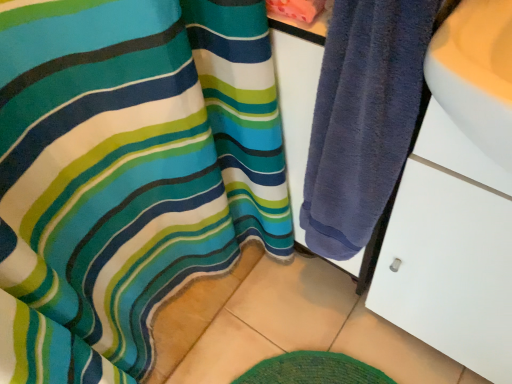
I want to click on white matte drawer at right, so click(x=449, y=268).

What do you see at coordinates (449, 268) in the screenshot?
I see `white matte drawer at right` at bounding box center [449, 268].

What is the approximate height of white matte drawer at right?

white matte drawer at right is 34.82 inches in height.

The height and width of the screenshot is (384, 512). What are the coordinates of `dark blue towel at right` in the screenshot? It's located at (362, 118).

The width and height of the screenshot is (512, 384). Describe the element at coordinates (362, 118) in the screenshot. I see `dark blue towel at right` at that location.

This screenshot has width=512, height=384. I want to click on white matte drawer at right, so click(x=449, y=268).

Which object is positioned more to the left, dark blue towel at right or white matte drawer at right?

dark blue towel at right.

Is dark blue towel at right further to the viewer compared to white matte drawer at right?

Yes, it is behind white matte drawer at right.

Is point (345, 43) closer to viewer compared to point (459, 360)?

Yes, point (345, 43) is in front of point (459, 360).

From the image's perspective, relative to white matte drawer at right, is dark blue towel at right above or below?

dark blue towel at right is above white matte drawer at right.

From a real-world perspective, which is physically below, dark blue towel at right or white matte drawer at right?

In real-world perspective, white matte drawer at right is lower.

In terms of width, does dark blue towel at right look wider or thinner when compared to white matte drawer at right?

dark blue towel at right is thinner than white matte drawer at right.

Can you confirm if dark blue towel at right is shorter than white matte drawer at right?

Indeed, dark blue towel at right has a lesser height compared to white matte drawer at right.

Between dark blue towel at right and white matte drawer at right, which one has larger size?

white matte drawer at right is bigger.

Would you say white matte drawer at right is part of dark blue towel at right's contents?

That's incorrect, white matte drawer at right is not inside dark blue towel at right.

Looking at this image, are dark blue towel at right and white matte drawer at right beside each other?

No, dark blue towel at right is not touching white matte drawer at right.

Is dark blue towel at right aimed at white matte drawer at right?

No, dark blue towel at right is not oriented towards white matte drawer at right.

How different are the orientations of dark blue towel at right and white matte drawer at right in degrees?

dark blue towel at right and white matte drawer at right are facing 0.366 degrees away from each other.

How much distance is there between dark blue towel at right and white matte drawer at right?

dark blue towel at right and white matte drawer at right are 17.18 centimeters apart.

Identify the location of drawer located on the right of dark blue towel at right. The height and width of the screenshot is (384, 512). (449, 268).

Which is more to the left, white matte drawer at right or dark blue towel at right?

dark blue towel at right.

In the image, is white matte drawer at right positioned in front of or behind dark blue towel at right?

white matte drawer at right is positioned closer to the viewer than dark blue towel at right.

Does point (407, 221) appear closer or farther from the camera than point (373, 80)?

Point (407, 221).

From the image's perspective, would you say white matte drawer at right is positioned over dark blue towel at right?

Incorrect, from the image's perspective, white matte drawer at right is lower than dark blue towel at right.

From a real-world perspective, between white matte drawer at right and dark blue towel at right, who is vertically lower?

white matte drawer at right, from a real-world perspective.

Can you confirm if white matte drawer at right is wider than dark blue towel at right?

Yes.

Who is shorter, white matte drawer at right or dark blue towel at right?

dark blue towel at right.

Considering the sizes of white matte drawer at right and dark blue towel at right in the image, is white matte drawer at right bigger or smaller than dark blue towel at right?

white matte drawer at right is bigger than dark blue towel at right.

Is white matte drawer at right spatially inside dark blue towel at right, or outside of it?

white matte drawer at right is spatially situated outside dark blue towel at right.

Is white matte drawer at right placed right next to dark blue towel at right?

No, white matte drawer at right is not touching dark blue towel at right.

Consider the image. Does white matte drawer at right turn towards dark blue towel at right?

No, white matte drawer at right is not facing towards dark blue towel at right.

What's the angular difference between white matte drawer at right and dark blue towel at right's facing directions?

white matte drawer at right and dark blue towel at right are facing 0.366 degrees away from each other.

Measure the distance from white matte drawer at right to dark blue towel at right.

They are 17.18 centimeters apart.

Find the location of a particular element. The width and height of the screenshot is (512, 384). drawer in front of the dark blue towel at right is located at coordinates (449, 268).

Locate an element on the screen. towel that appears behind the white matte drawer at right is located at coordinates (362, 118).

At what (x,y) coordinates should I click in order to perform the action: click on drawer that is in front of the dark blue towel at right. Please return your answer as a coordinate pair (x, y). This screenshot has height=384, width=512. Looking at the image, I should click on (449, 268).